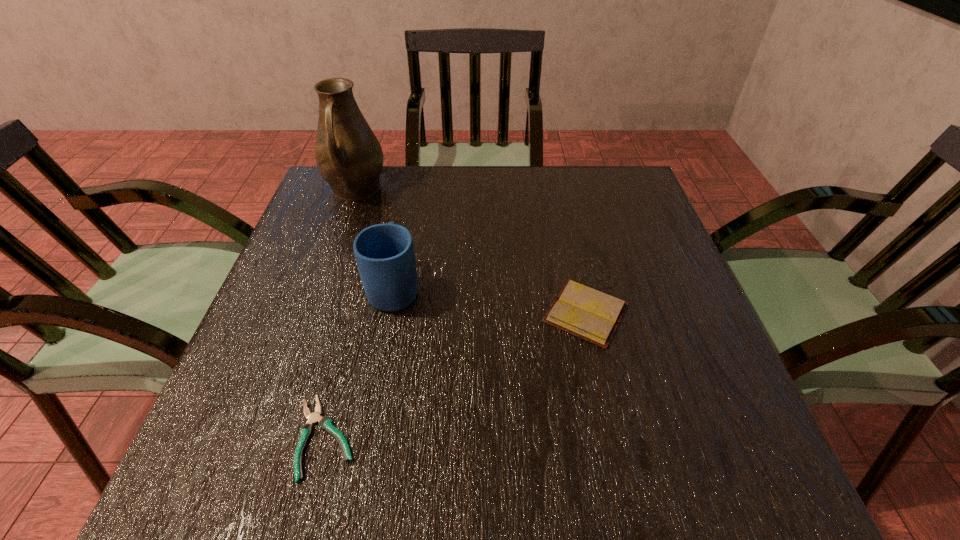
Where is `vacant space that satisfies the following two spatial constraints: 1. on the handle side of the nearest object; 2. on the left side of the pitcher`? vacant space that satisfies the following two spatial constraints: 1. on the handle side of the nearest object; 2. on the left side of the pitcher is located at coordinates (269, 437).